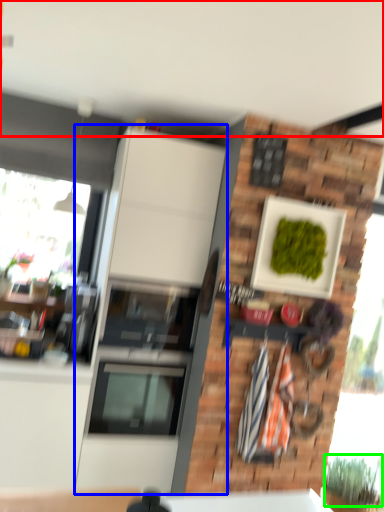
Question: Considering the real-world distances, which object is farthest from backdrop (highlighted by a red box)? cabinetry (highlighted by a blue box) or plant (highlighted by a green box)?

Choices:
 (A) cabinetry
 (B) plant

Answer: (B)